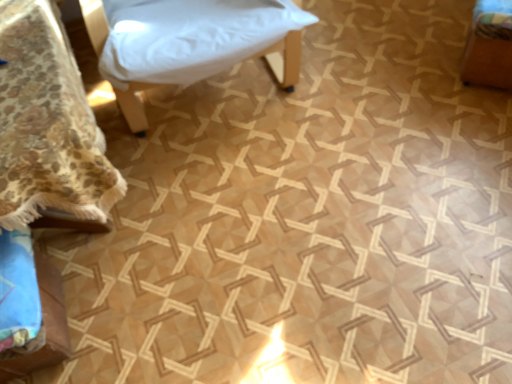
Locate an element on the screen. unoccupied space behind wooden box at right, acting as the 4th furniture starting from the left is located at coordinates (438, 26).